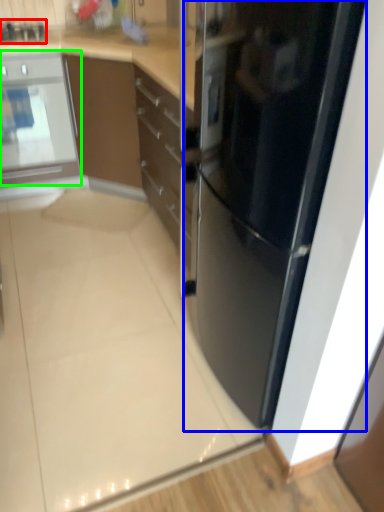
Question: Which object is positioned closest to appliance (highlighted by a red box)? Select from refrigerator (highlighted by a blue box) and home appliance (highlighted by a green box).

Choices:
 (A) refrigerator
 (B) home appliance

Answer: (B)